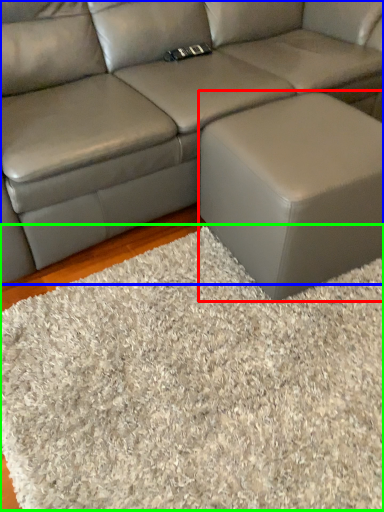
Question: Considering the real-world distances, which object is closest to stool (highlighted by a red box)? studio couch (highlighted by a blue box) or mat (highlighted by a green box).

Choices:
 (A) studio couch
 (B) mat

Answer: (B)